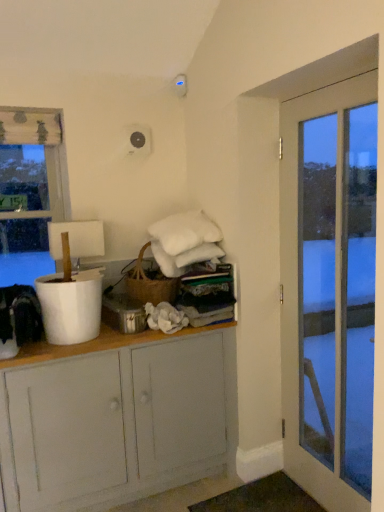
Question: Is white glass door at right taller or shorter than transparent glass window at left?

Choices:
 (A) tall
 (B) short

Answer: (A)

Question: From a real-world perspective, is white glass door at right physically located above or below transparent glass window at left?

Choices:
 (A) below
 (B) above

Answer: (A)

Question: Estimate the real-world distances between objects in this image. Which object is closer to the white painted wood cabinet at center?

Choices:
 (A) white glass door at right
 (B) transparent glass window at left

Answer: (A)

Question: Which of these objects is positioned closest to the transparent glass window at left?

Choices:
 (A) white glass door at right
 (B) white painted wood cabinet at center

Answer: (B)